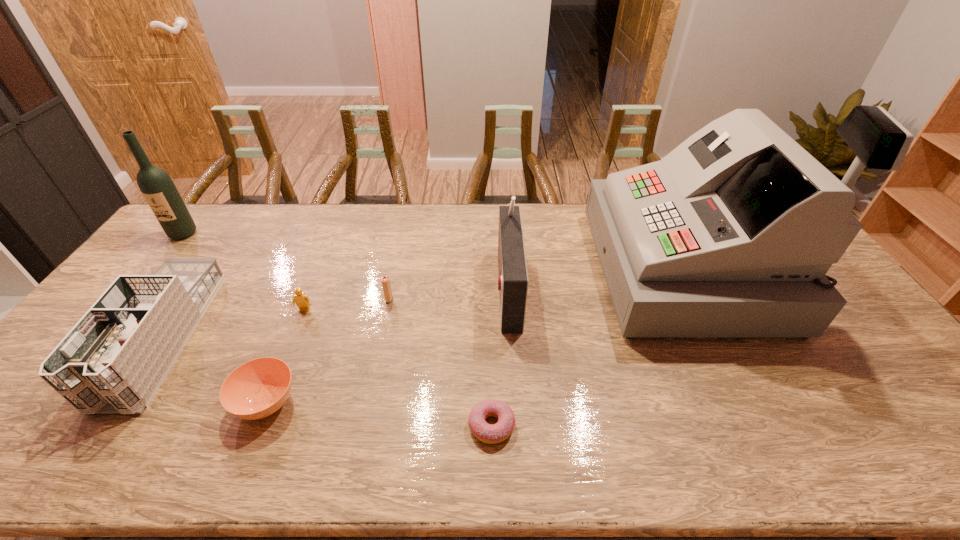
At what (x,y) coordinates should I click in order to perform the action: click on object that is at the far right corner. Please return your answer as a coordinate pair (x, y). Looking at the image, I should click on (731, 234).

This screenshot has height=540, width=960. Find the location of `free space at the far edge of the desktop`. free space at the far edge of the desktop is located at coordinates (284, 233).

In the image, there is a desktop. Identify the location of vacant space at the left edge. Image resolution: width=960 pixels, height=540 pixels. (162, 262).

Where is `vacant space at the right edge of the desktop`? This screenshot has height=540, width=960. vacant space at the right edge of the desktop is located at coordinates (875, 333).

The image size is (960, 540). Identify the location of vacant space at the far left corner of the desktop. (201, 222).

At what (x,y) coordinates should I click in order to perform the action: click on free space between the sixth shortest object and the shortest object. Please return your answer as a coordinate pair (x, y). Image resolution: width=960 pixels, height=540 pixels. Looking at the image, I should click on (499, 356).

Where is `free space between the wine bottle and the shortest object`? This screenshot has height=540, width=960. free space between the wine bottle and the shortest object is located at coordinates (338, 329).

You are a GUI agent. You are given a task and a screenshot of the screen. Output one action in this format:
    pyautogui.click(x=<x>, y=<y>)
    Task: Click on the vacant region between the soup bowl and the third tallest object
    Image resolution: width=960 pixels, height=540 pixels.
    Given the screenshot: What is the action you would take?
    pyautogui.click(x=387, y=345)

Find the location of a particular element. This screenshot has width=960, height=540. free spot between the radio receiver and the soup bowl is located at coordinates (387, 345).

Locate an element on the screen. empty location between the tallest object and the Lego is located at coordinates (495, 290).